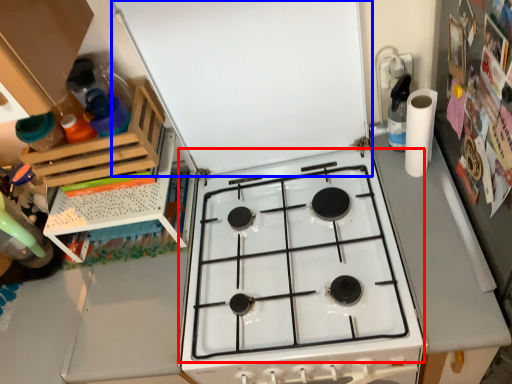
Question: Among these objects, which one is farthest to the camera, gas stove (highlighted by a red box) or exhaust hood (highlighted by a blue box)?

Choices:
 (A) gas stove
 (B) exhaust hood

Answer: (A)